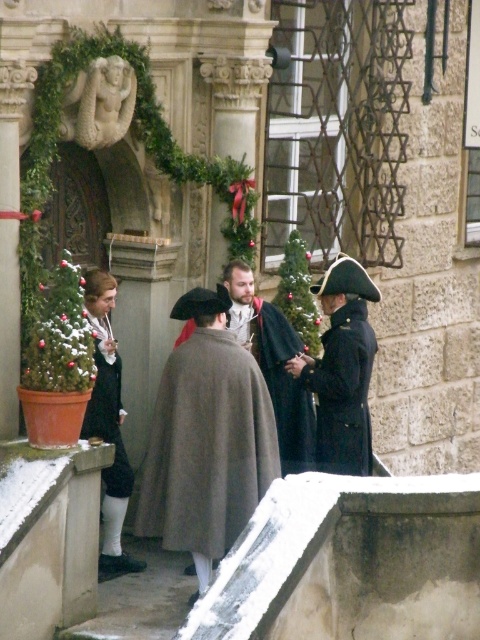
Who is positioned more to the right, brown woolen cape at center or dark gray woolen robe at center?

From the viewer's perspective, brown woolen cape at center appears more on the right side.

Which is below, brown woolen cape at center or dark gray woolen robe at center?

dark gray woolen robe at center is below.

What do you see at coordinates (273, 365) in the screenshot?
I see `brown woolen cape at center` at bounding box center [273, 365].

The width and height of the screenshot is (480, 640). In order to click on brown woolen cape at center in this screenshot , I will do `click(273, 365)`.

Does gray woolen cloak at center appear on the left side of brown woolen cape at center?

Correct, you'll find gray woolen cloak at center to the left of brown woolen cape at center.

Is gray woolen cloak at center bigger than brown woolen cape at center?

Indeed, gray woolen cloak at center has a larger size compared to brown woolen cape at center.

Which is in front, point (197, 529) or point (282, 422)?

Point (197, 529)

Where is `gray woolen cloak at center`? gray woolen cloak at center is located at coordinates (206, 445).

Consider the image. Which of these two, gray woolen cloak at center or dark gray woolen robe at center, stands shorter?

dark gray woolen robe at center

Does gray woolen cloak at center appear over dark gray woolen robe at center?

Actually, gray woolen cloak at center is below dark gray woolen robe at center.

Between point (254, 417) and point (100, 378), which one is positioned in front?

Positioned in front is point (254, 417).

At what (x,y) coordinates should I click in order to perform the action: click on gray woolen cloak at center. Please return your answer as a coordinate pair (x, y). Looking at the image, I should click on (206, 445).